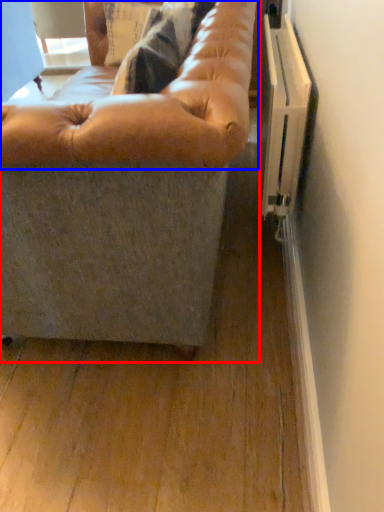
Question: Which object appears closest to the camera in this image, studio couch (highlighted by a red box) or bean bag chair (highlighted by a blue box)?

Choices:
 (A) studio couch
 (B) bean bag chair

Answer: (A)